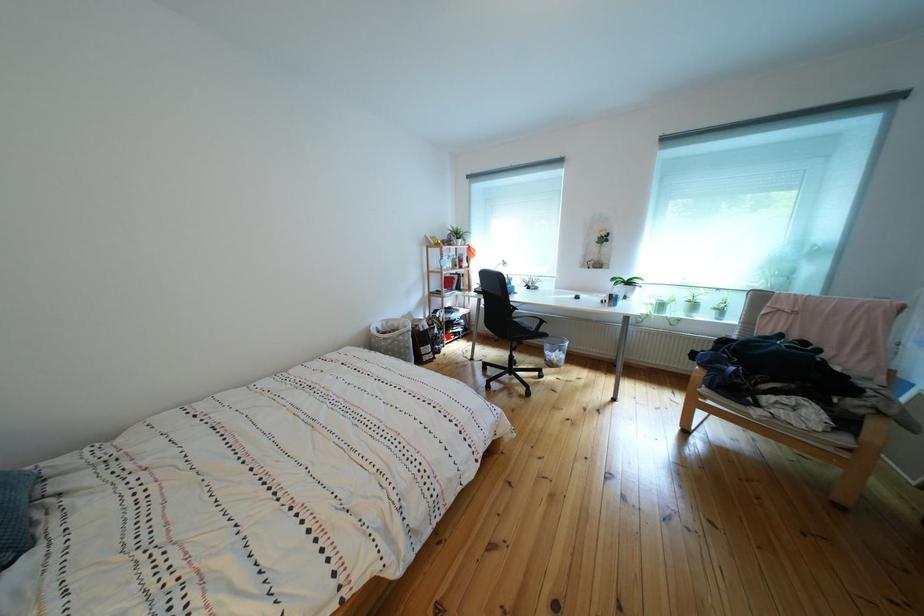
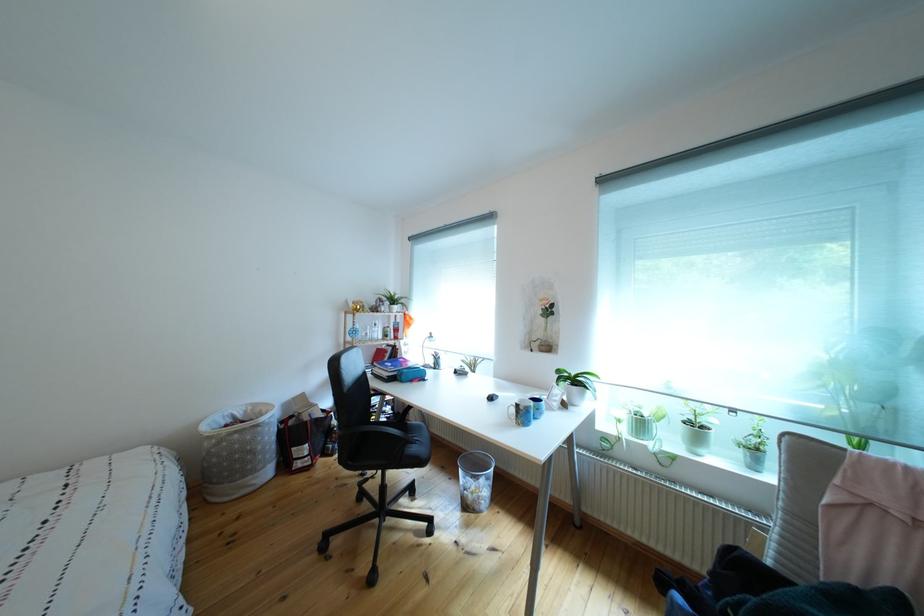
Question: I am providing you with two images of the same scene from different viewpoints. Given a red point in image1, look at the same physical point in image2. Is it:

Choices:
 (A) Closer to the viewpoint
 (B) Farther from the viewpoint

Answer: (B)